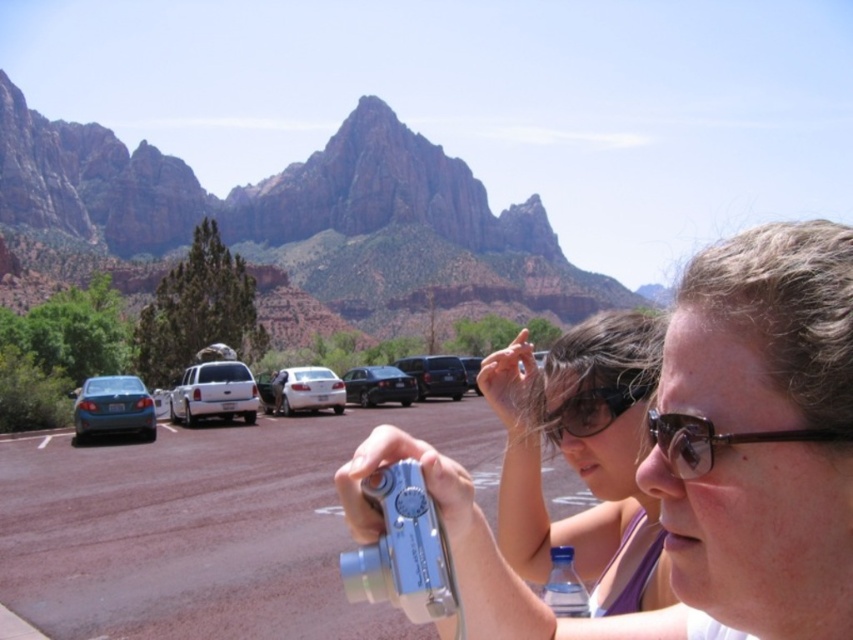
Question: Can you confirm if rustic rock formation at upper left is thinner than shiny black sedan at center?

Choices:
 (A) yes
 (B) no

Answer: (B)

Question: Is matte black sunglasses at center positioned before shiny black sedan at center?

Choices:
 (A) yes
 (B) no

Answer: (A)

Question: Which object is farther from the camera taking this photo?

Choices:
 (A) metallic silver suv at center
 (B) white matte car at center
 (C) matte black goggles at center
 (D) brown plastic glasses at center

Answer: (A)

Question: Which object appears farthest from the camera in this image?

Choices:
 (A) matte black sunglasses at center
 (B) white matte car at center

Answer: (B)

Question: Can you confirm if blue metallic camera at center is bigger than white matte suv at center?

Choices:
 (A) no
 (B) yes

Answer: (A)

Question: Which point is closer to the camera?

Choices:
 (A) (177, 160)
 (B) (440, 579)
 (C) (691, 464)

Answer: (B)